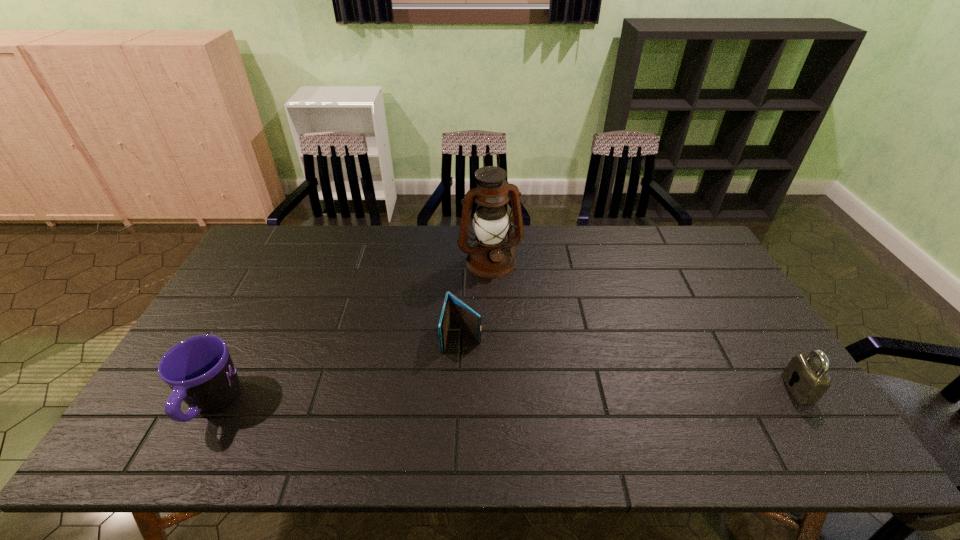
Where is `object positioned at the near left corner`? Image resolution: width=960 pixels, height=540 pixels. object positioned at the near left corner is located at coordinates (200, 371).

At what (x,y) coordinates should I click in order to perform the action: click on object that is at the near right corner. Please return your answer as a coordinate pair (x, y). Looking at the image, I should click on 810,381.

You are a GUI agent. You are given a task and a screenshot of the screen. Output one action in this format:
    pyautogui.click(x=<x>, y=<y>)
    Task: Click on the free space at the far edge of the desktop
    The image size is (960, 540).
    Given the screenshot: What is the action you would take?
    pyautogui.click(x=651, y=251)

In the image, there is a desktop. At what (x,y) coordinates should I click in order to perform the action: click on free space at the near edge. Please return your answer as a coordinate pair (x, y). The height and width of the screenshot is (540, 960). Looking at the image, I should click on (465, 388).

Locate an element on the screen. vacant space at the left edge of the desktop is located at coordinates (213, 320).

Identify the location of free space at the right edge. (713, 351).

Find the location of a particular element. This screenshot has width=960, height=540. vacant space at the far left corner of the desktop is located at coordinates (253, 246).

Locate an element on the screen. This screenshot has width=960, height=540. blank space at the far right corner is located at coordinates (672, 234).

At what (x,y) coordinates should I click in order to perform the action: click on vacant space that is in between the rightmost object and the leftmost object. Please return your answer as a coordinate pair (x, y). Looking at the image, I should click on (505, 396).

Image resolution: width=960 pixels, height=540 pixels. I want to click on free space between the leftmost object and the shortest object, so click(337, 370).